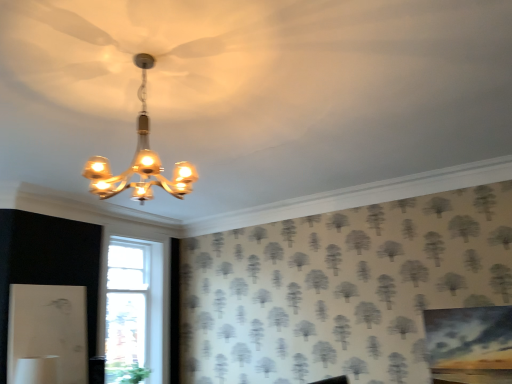
Find the location of a particular element. The height and width of the screenshot is (384, 512). green leafy plant at lower left is located at coordinates (125, 373).

What do you see at coordinates (125, 373) in the screenshot? I see `green leafy plant at lower left` at bounding box center [125, 373].

Image resolution: width=512 pixels, height=384 pixels. What do you see at coordinates (140, 160) in the screenshot? I see `matte gold chandelier at upper center` at bounding box center [140, 160].

What is the approximate height of matte gold chandelier at upper center?

matte gold chandelier at upper center is 28.02 inches in height.

Find the location of a particular element. Image resolution: width=512 pixels, height=384 pixels. matte gold chandelier at upper center is located at coordinates (140, 160).

Looking at this image, measure the distance between matte gold chandelier at upper center and camera.

The depth of matte gold chandelier at upper center is 6.84 feet.

Measure the distance between point (144, 198) and camera.

Point (144, 198) is 4.18 meters from camera.

Find the location of a particular element. This screenshot has height=384, width=512. green leafy plant at lower left is located at coordinates (125, 373).

Considering the positions of objects matte gold chandelier at upper center and green leafy plant at lower left in the image provided, who is more to the right, matte gold chandelier at upper center or green leafy plant at lower left?

Positioned to the right is matte gold chandelier at upper center.

Is matte gold chandelier at upper center positioned behind green leafy plant at lower left?

That is False.

Does point (139, 180) appear closer or farther from the camera than point (148, 375)?

Point (139, 180) appears to be closer to the viewer than point (148, 375).

From the image's perspective, is matte gold chandelier at upper center positioned above or below green leafy plant at lower left?

Based on their image positions, matte gold chandelier at upper center is located above green leafy plant at lower left.

Consider the image. From a real-world perspective, is matte gold chandelier at upper center located higher than green leafy plant at lower left?

Indeed, from a real-world perspective, matte gold chandelier at upper center stands above green leafy plant at lower left.

Which object is wider, matte gold chandelier at upper center or green leafy plant at lower left?

matte gold chandelier at upper center.

Between matte gold chandelier at upper center and green leafy plant at lower left, which one has more height?

matte gold chandelier at upper center.

Can you confirm if matte gold chandelier at upper center is bigger than green leafy plant at lower left?

Yes, matte gold chandelier at upper center is bigger than green leafy plant at lower left.

Is matte gold chandelier at upper center located outside green leafy plant at lower left?

Indeed, matte gold chandelier at upper center is completely outside green leafy plant at lower left.

Is matte gold chandelier at upper center directly adjacent to green leafy plant at lower left?

There is a gap between matte gold chandelier at upper center and green leafy plant at lower left.

Is matte gold chandelier at upper center looking in the opposite direction of green leafy plant at lower left?

No, green leafy plant at lower left is not at the back of matte gold chandelier at upper center.

How many degrees apart are the facing directions of matte gold chandelier at upper center and green leafy plant at lower left?

They differ by 3.4 degrees in their facing directions.

Measure the distance from matte gold chandelier at upper center to green leafy plant at lower left.

matte gold chandelier at upper center is 8.80 feet away from green leafy plant at lower left.

Find the location of a particular element. This screenshot has height=384, width=512. lamp on the right of green leafy plant at lower left is located at coordinates (140, 160).

Is green leafy plant at lower left at the left side of matte gold chandelier at upper center?

Yes, green leafy plant at lower left is to the left of matte gold chandelier at upper center.

Which object is further away from the camera, green leafy plant at lower left or matte gold chandelier at upper center?

green leafy plant at lower left is behind.

Which point is more distant from viewer, (x=136, y=380) or (x=110, y=196)?

The point (x=136, y=380) is farther.

From the image's perspective, is green leafy plant at lower left beneath matte gold chandelier at upper center?

Correct, green leafy plant at lower left appears lower than matte gold chandelier at upper center in the image.

From a real-world perspective, does green leafy plant at lower left sit lower than matte gold chandelier at upper center?

Yes.

Is green leafy plant at lower left wider or thinner than matte gold chandelier at upper center?

Considering their sizes, green leafy plant at lower left looks slimmer than matte gold chandelier at upper center.

Between green leafy plant at lower left and matte gold chandelier at upper center, which one has less height?

green leafy plant at lower left.

Considering the sizes of objects green leafy plant at lower left and matte gold chandelier at upper center in the image provided, who is bigger, green leafy plant at lower left or matte gold chandelier at upper center?

matte gold chandelier at upper center.

Would you say green leafy plant at lower left contains matte gold chandelier at upper center?

Actually, matte gold chandelier at upper center is outside green leafy plant at lower left.

Is green leafy plant at lower left in contact with matte gold chandelier at upper center?

They are not placed beside each other.

Is green leafy plant at lower left facing away from matte gold chandelier at upper center?

green leafy plant at lower left is not turned away from matte gold chandelier at upper center.

What's the angular difference between green leafy plant at lower left and matte gold chandelier at upper center's facing directions?

They differ by 3.4 degrees in their facing directions.

How much distance is there between green leafy plant at lower left and matte gold chandelier at upper center?

2.68 meters.

Locate an element on the screen. The height and width of the screenshot is (384, 512). lamp that appears above the green leafy plant at lower left (from a real-world perspective) is located at coordinates (140, 160).

I want to click on plant that is below the matte gold chandelier at upper center (from the image's perspective), so click(x=125, y=373).

The image size is (512, 384). Identify the location of lamp that appears above the green leafy plant at lower left (from the image's perspective). (140, 160).